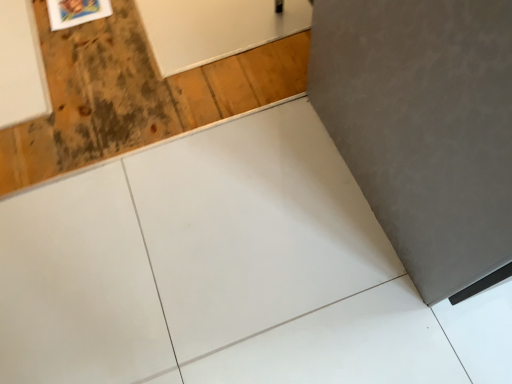
Identify the location of vacant area situated below wooden frame at upper left (from a real-world perspective). The width and height of the screenshot is (512, 384). (78, 11).